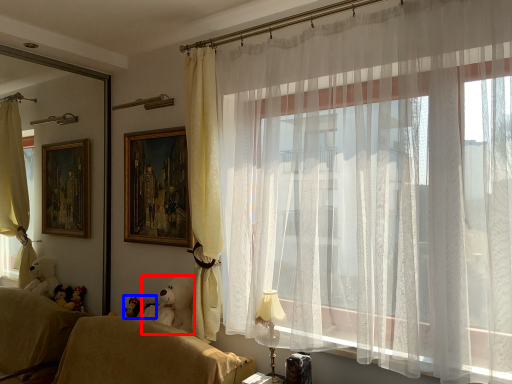
Question: Which object is further to the camera taking this photo, animal (highlighted by a red box) or toy (highlighted by a blue box)?

Choices:
 (A) animal
 (B) toy

Answer: (B)